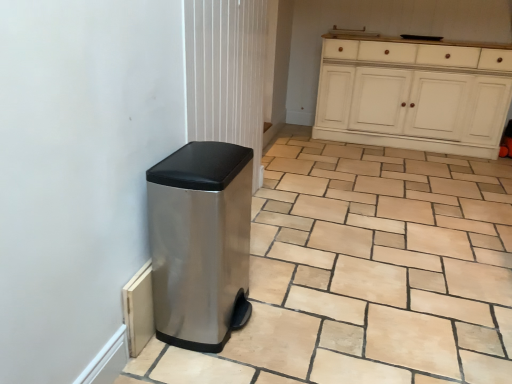
Question: From the image's perspective, does beige stone tile at lower center appear lower than white painted wood cabinet at upper right?

Choices:
 (A) no
 (B) yes

Answer: (B)

Question: From the image's perspective, does beige stone tile at lower center appear higher than white painted wood cabinet at upper right?

Choices:
 (A) yes
 (B) no

Answer: (B)

Question: Does beige stone tile at lower center have a larger size compared to white painted wood cabinet at upper right?

Choices:
 (A) yes
 (B) no

Answer: (B)

Question: Can you confirm if beige stone tile at lower center is thinner than white painted wood cabinet at upper right?

Choices:
 (A) no
 (B) yes

Answer: (A)

Question: Is beige stone tile at lower center next to white painted wood cabinet at upper right?

Choices:
 (A) yes
 (B) no

Answer: (B)

Question: Does beige stone tile at lower center contain white painted wood cabinet at upper right?

Choices:
 (A) yes
 (B) no

Answer: (B)

Question: Is white painted wood cabinet at upper right to the left of polished stainless steel trash can at lower left from the viewer's perspective?

Choices:
 (A) no
 (B) yes

Answer: (A)

Question: Is white painted wood cabinet at upper right located outside polished stainless steel trash can at lower left?

Choices:
 (A) no
 (B) yes

Answer: (B)

Question: Considering the relative sizes of white painted wood cabinet at upper right and polished stainless steel trash can at lower left in the image provided, is white painted wood cabinet at upper right shorter than polished stainless steel trash can at lower left?

Choices:
 (A) yes
 (B) no

Answer: (B)

Question: Could polished stainless steel trash can at lower left be considered to be inside white painted wood cabinet at upper right?

Choices:
 (A) yes
 (B) no

Answer: (B)

Question: From a real-world perspective, is white painted wood cabinet at upper right located higher than polished stainless steel trash can at lower left?

Choices:
 (A) no
 (B) yes

Answer: (B)

Question: Is white painted wood cabinet at upper right to the right of polished stainless steel trash can at lower left from the viewer's perspective?

Choices:
 (A) yes
 (B) no

Answer: (A)

Question: From the image's perspective, is polished stainless steel trash can at lower left below white painted wood cabinet at upper right?

Choices:
 (A) yes
 (B) no

Answer: (A)